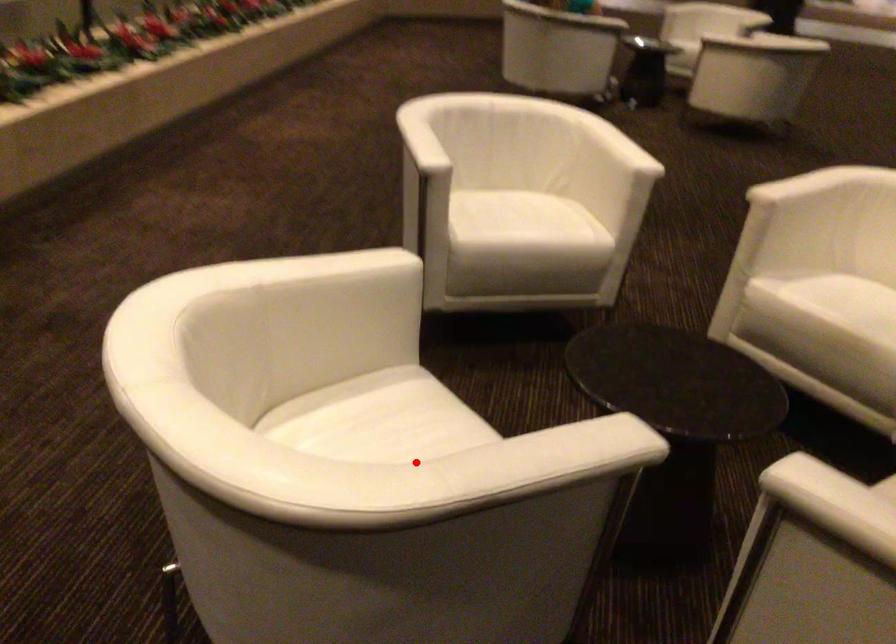
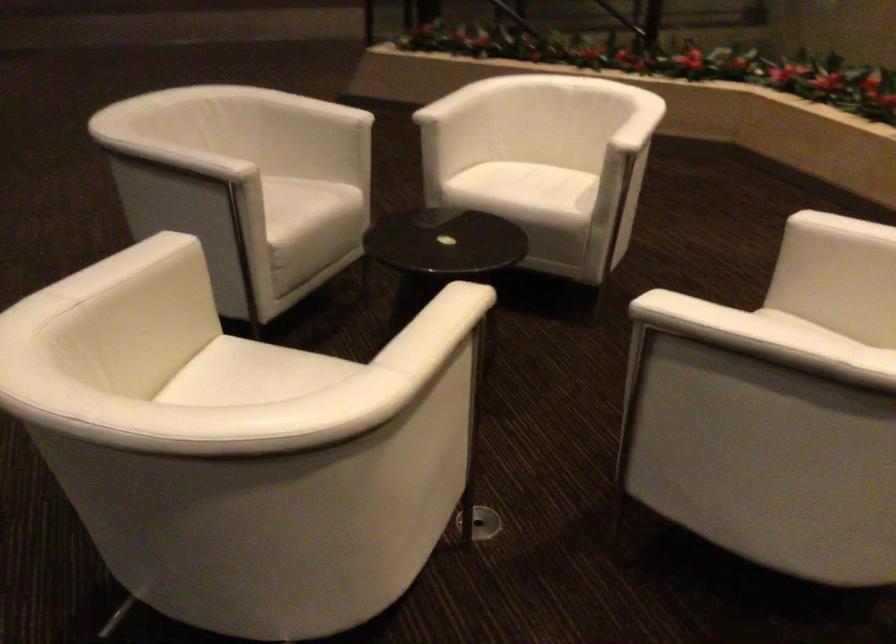
Question: I am providing you with two images of the same scene from different viewpoints. A red point is marked on the first image. At the location where the point appears in image 1, is it still visible in image 2?

Choices:
 (A) Yes
 (B) No

Answer: (A)